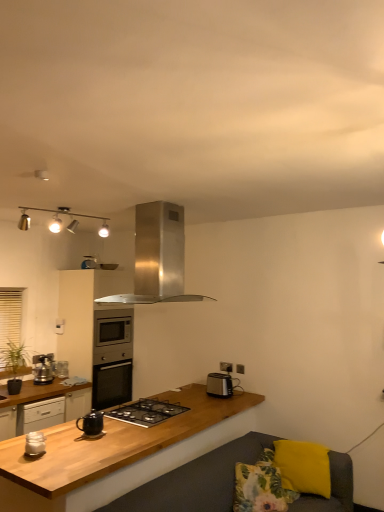
Question: Is black glass gas stove at center bigger or smaller than yellow fabric pillow at lower right, the first pillow positioned from the right?

Choices:
 (A) big
 (B) small

Answer: (B)

Question: Is black glass gas stove at center spatially inside yellow fabric pillow at lower right, positioned as the 2th pillow in left-to-right order, or outside of it?

Choices:
 (A) outside
 (B) inside

Answer: (A)

Question: Estimate the real-world distances between objects in this image. Which object is farther from the matte black kettle at center?

Choices:
 (A) wooden cabinet at lower left, placed as the second cabinetry when sorted from back to front
 (B) wooden at center
 (C) white plastic electric outlet at upper right
 (D) yellow fabric pillow at lower right, the first pillow positioned from the right
 (E) metallic silver toaster at left, which is counted as the first kitchen appliance, starting from the bottom

Answer: (D)

Question: Estimate the real-world distances between objects in this image. Which object is farther from the matte black kettle at center?

Choices:
 (A) black plastic toaster at right, which appears as the third kitchen appliance when viewed from the front
 (B) wooden cabinet at lower left, placed as the second cabinetry when sorted from back to front
 (C) white glossy jar at lower left, which is counted as the 4th kitchen appliance, starting from the back
 (D) metallic track lights at upper center
 (E) white plastic electric outlet at upper right

Answer: (D)